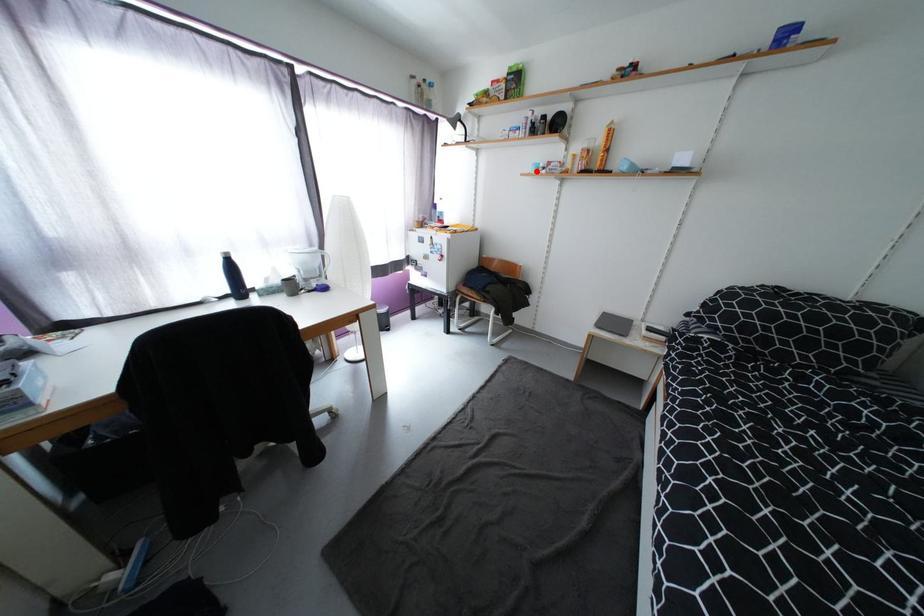
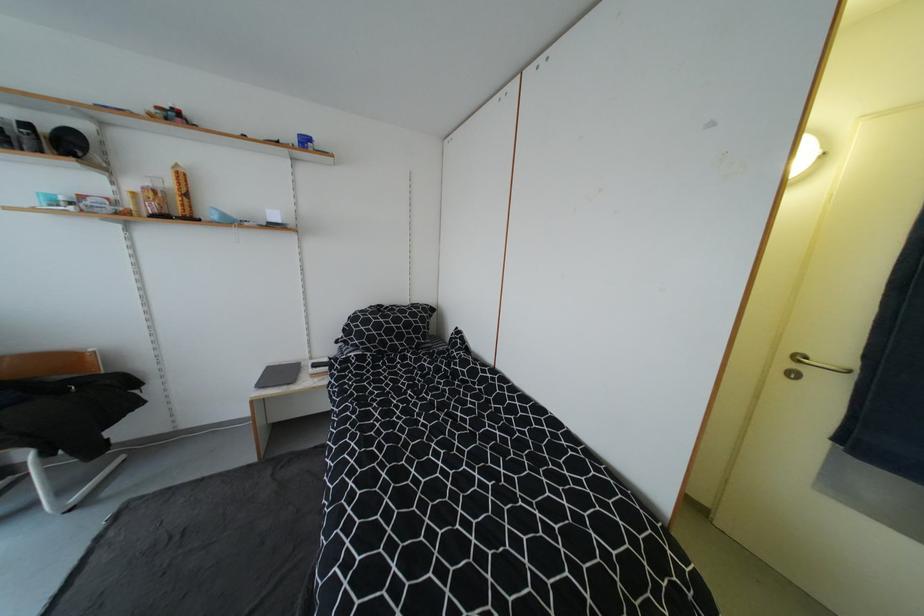
Question: I am providing you with two images of the same scene from different viewpoints. In image1, a red point is highlighted. Considering the same 3D point in image2, which of the following is correct?

Choices:
 (A) It is closer
 (B) It is farther

Answer: (B)